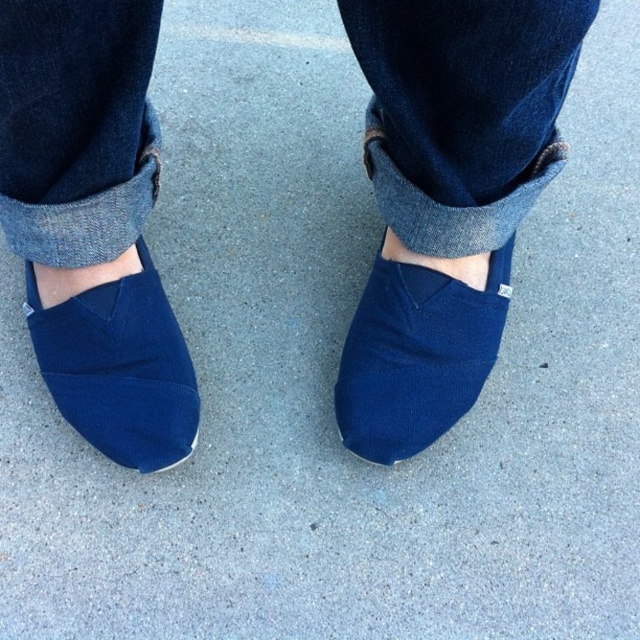
What are the coordinates of the navy blue canvas shoes at center in the image?

The navy blue canvas shoes at center are located at coordinates point [445,198].